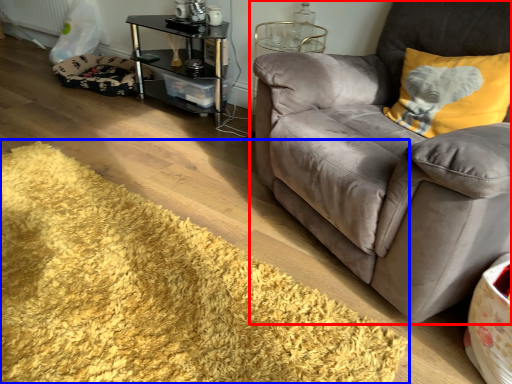
Question: Which of the following is the farthest to the observer, studio couch (highlighted by a red box) or mat (highlighted by a blue box)?

Choices:
 (A) studio couch
 (B) mat

Answer: (A)